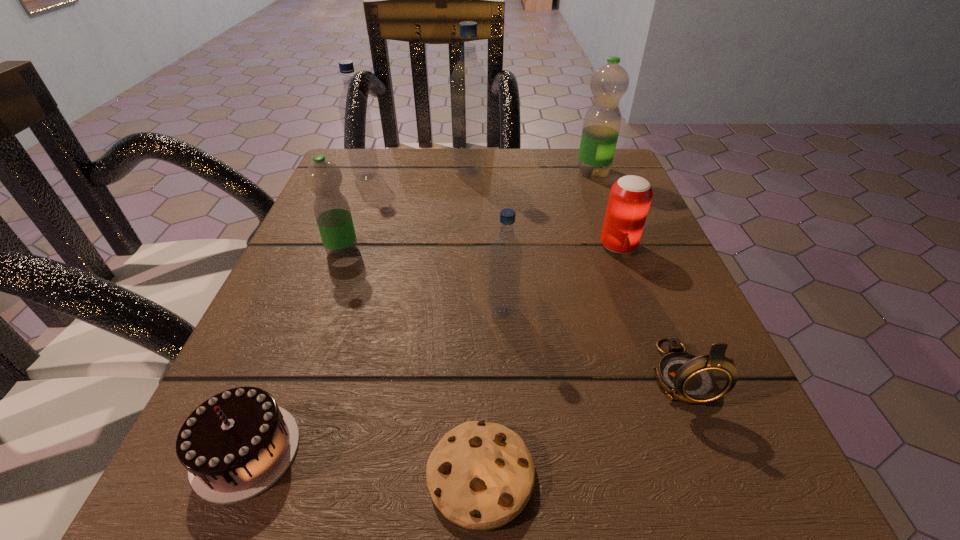
Choose which water bottle is the fourth nearest neighbor to the shortest object. Please provide its 2D coordinates. Your answer should be formatted as a tuple, i.e. [(x, y)], where the tuple contains the x and y coordinates of a point satisfying the conditions above.

[(353, 106)]

The height and width of the screenshot is (540, 960). What are the coordinates of `the closest water bottle to the brown cookie` in the screenshot? It's located at (505, 254).

Identify the location of blue water bottle that can be found as the second closest to the second smallest blue water bottle. (505, 254).

This screenshot has width=960, height=540. Identify the location of blue water bottle that is the closest to the leftmost blue water bottle. coord(469,83).

Locate an element on the screen. vacant position in the image that satisfies the following two spatial constraints: 1. on the back side of the beer can; 2. on the right side of the chocolate cake is located at coordinates (330, 246).

The image size is (960, 540). Find the location of `vacant region that satisfies the following two spatial constraints: 1. on the back side of the farther green water bottle; 2. on the right side of the beer can`. vacant region that satisfies the following two spatial constraints: 1. on the back side of the farther green water bottle; 2. on the right side of the beer can is located at coordinates (590, 172).

At what (x,y) coordinates should I click in order to perform the action: click on free space that satisfies the following two spatial constraints: 1. on the front side of the cookie; 2. on the left side of the leftmost blue water bottle. Please return your answer as a coordinate pair (x, y). The height and width of the screenshot is (540, 960). Looking at the image, I should click on (253, 475).